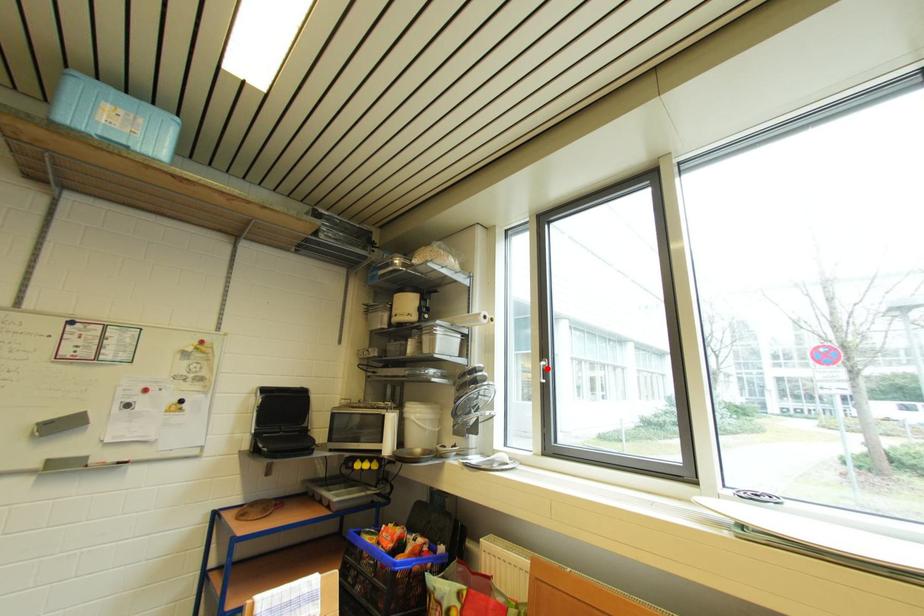
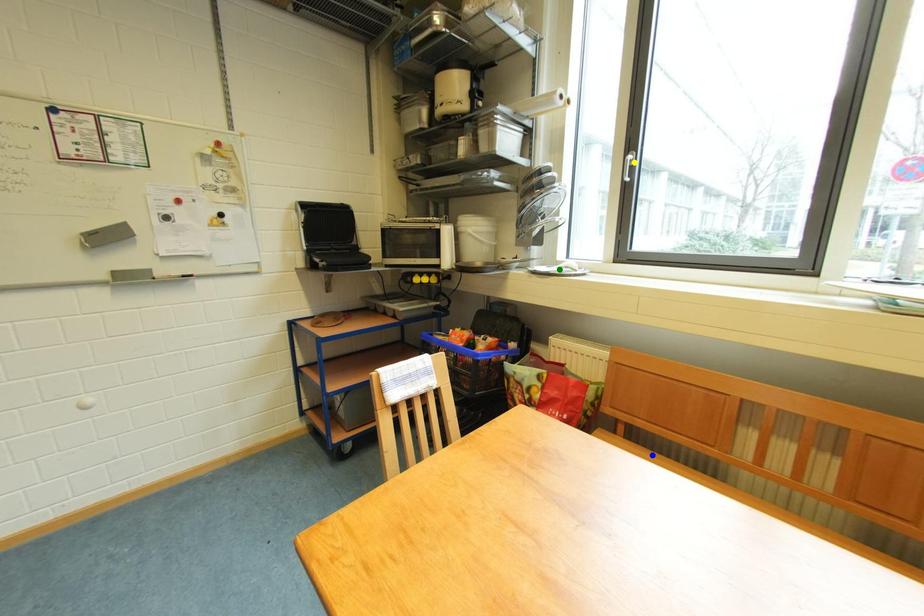
Question: I am providing you with two images of the same scene from different viewpoints. A red point is marked on the first image. You are given multiple points on the second image. Can you choose the point in image 2 that corresponds to the point in image 1?

Choices:
 (A) blue point
 (B) yellow point
 (C) green point

Answer: (B)